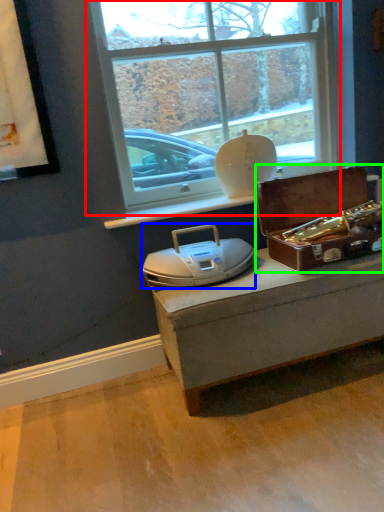
Question: Based on their relative distances, which object is farther from window (highlighted by a red box)? Choose from stereo (highlighted by a blue box) and box (highlighted by a green box).

Choices:
 (A) stereo
 (B) box

Answer: (A)